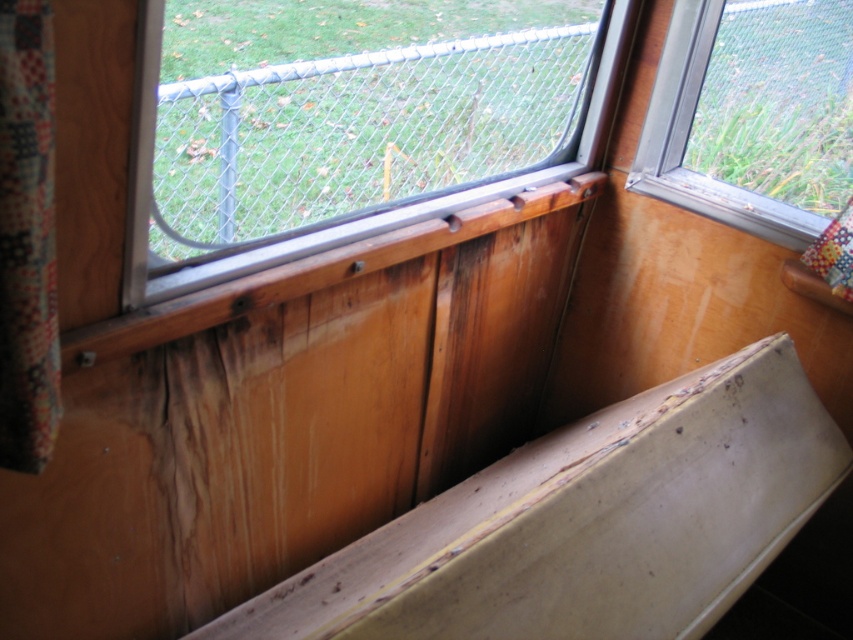
Question: Which object is closer to the camera taking this photo?

Choices:
 (A) clear glass window at upper right
 (B) metal chain-link fence at upper center

Answer: (B)

Question: Is metal chain-link fence at upper center further to the viewer compared to clear glass window at upper right?

Choices:
 (A) yes
 (B) no

Answer: (B)

Question: Can you confirm if metal chain-link fence at upper center is wider than clear glass window at upper right?

Choices:
 (A) yes
 (B) no

Answer: (A)

Question: Can you confirm if metal chain-link fence at upper center is smaller than clear glass window at upper right?

Choices:
 (A) yes
 (B) no

Answer: (B)

Question: Which point is closer to the camera?

Choices:
 (A) (228, 214)
 (B) (666, 116)

Answer: (B)